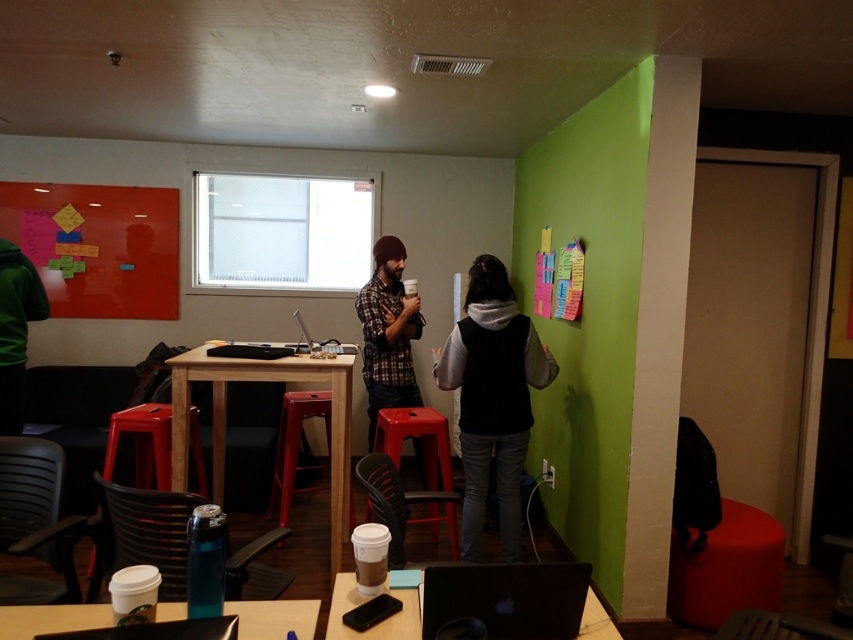
Looking at this image, is wooden table at lower center further to camera compared to silver metallic laptop at center?

No, it is in front of silver metallic laptop at center.

In the scene shown: Is wooden table at lower center shorter than silver metallic laptop at center?

Yes.

Is point (16, 636) farther from camera compared to point (338, 342)?

No, (16, 636) is closer to viewer.

Find the location of `wooden table at lower center`. wooden table at lower center is located at coordinates (274, 618).

The image size is (853, 640). What are the coordinates of `black glossy laptop at lower center` in the screenshot? It's located at (508, 598).

Which of these two, black glossy laptop at lower center or silver metallic laptop at center, stands shorter?

Standing shorter between the two is black glossy laptop at lower center.

Where is `black glossy laptop at lower center`? The image size is (853, 640). black glossy laptop at lower center is located at coordinates (508, 598).

Does light brown wooden table at center have a greater height compared to wooden stool at lower left?

Correct, light brown wooden table at center is much taller as wooden stool at lower left.

Describe the element at coordinates (265, 380) in the screenshot. I see `light brown wooden table at center` at that location.

This screenshot has width=853, height=640. What do you see at coordinates (265, 380) in the screenshot?
I see `light brown wooden table at center` at bounding box center [265, 380].

The width and height of the screenshot is (853, 640). Identify the location of light brown wooden table at center. (265, 380).